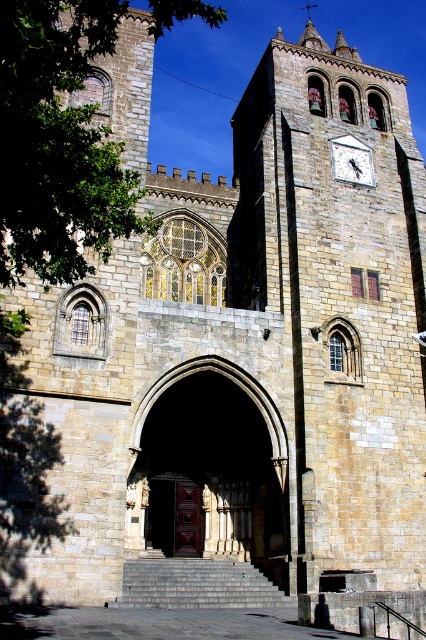
You are standing at the base of the gray stone stairs at center and want to reach the entrance of the historic stone church. Which direction should you walk to get there?

You should walk towards the entrance located to the left of the gray stone stairs at center, as the stairs are positioned centrally and the entrance is to their left.

You are standing in front of the historic stone church and want to locate the stone archway at center. Which direction should you look to find it?

The stone archway at center is located at the central part of the church facade, so you should look straight ahead to find it.